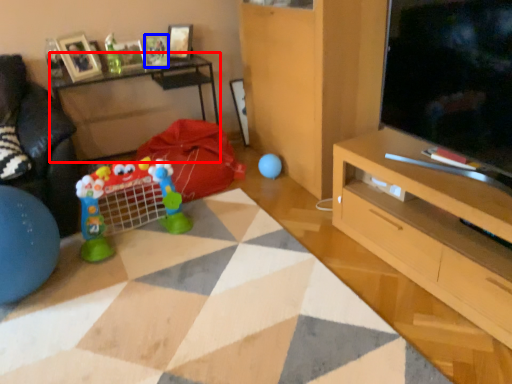
Question: Which object appears closest to the camera in this image, table (highlighted by a red box) or picture frame (highlighted by a blue box)?

Choices:
 (A) table
 (B) picture frame

Answer: (A)